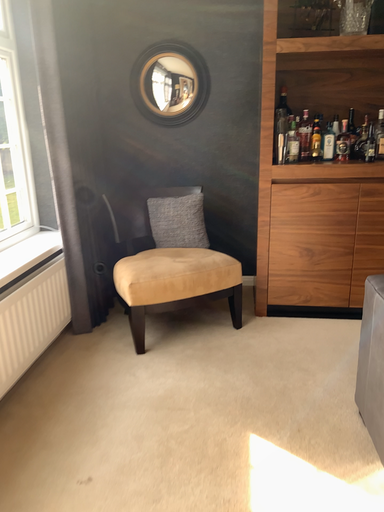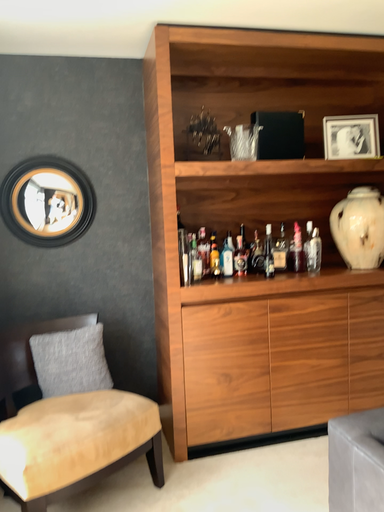
Question: How did the camera likely rotate when shooting the video?

Choices:
 (A) rotated downward
 (B) rotated upward

Answer: (B)